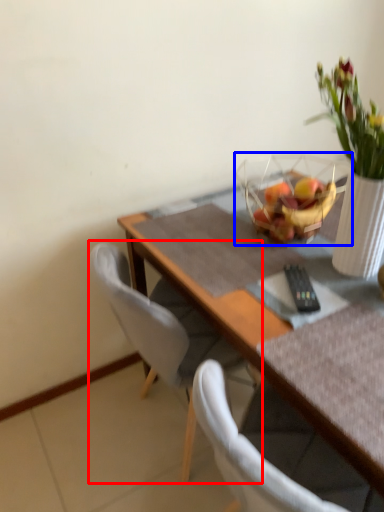
Question: Which point is further to the camera, chair (highlighted by a red box) or basket (highlighted by a blue box)?

Choices:
 (A) chair
 (B) basket

Answer: (B)